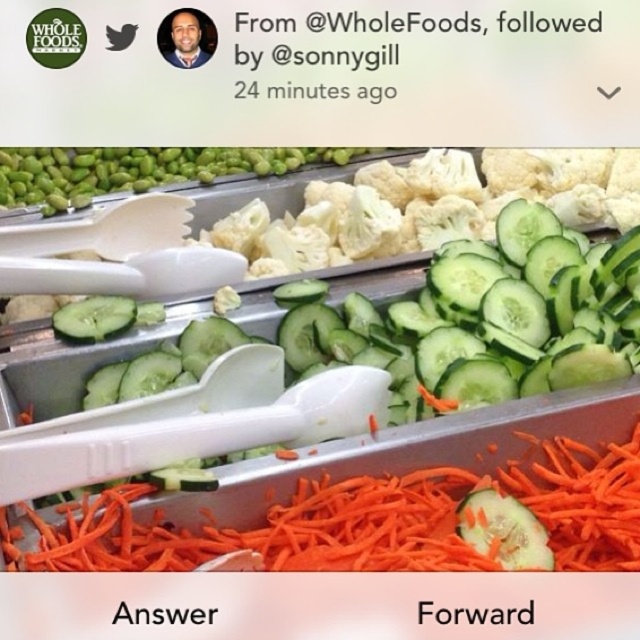
You are a customer at Whole Foods looking to grab some vegetables for a salad. You see the green matte cucumber at center and the orange shredded carrot at lower center. Which vegetable is closer to you?

The green matte cucumber at center is closer to you because it is in front of the orange shredded carrot at lower center.

Where is the green matte cucumber at center located in the image?

The green matte cucumber at center is located at point (483,320) in the image.

Based on the photo, you are holding a measuring tape and want to measure the distance between yourself and the point at coordinates (333,493) in the image. What is the actual distance in inches between you and that point?

The actual distance between you and the point at coordinates (333,493) is 33.24 inches.